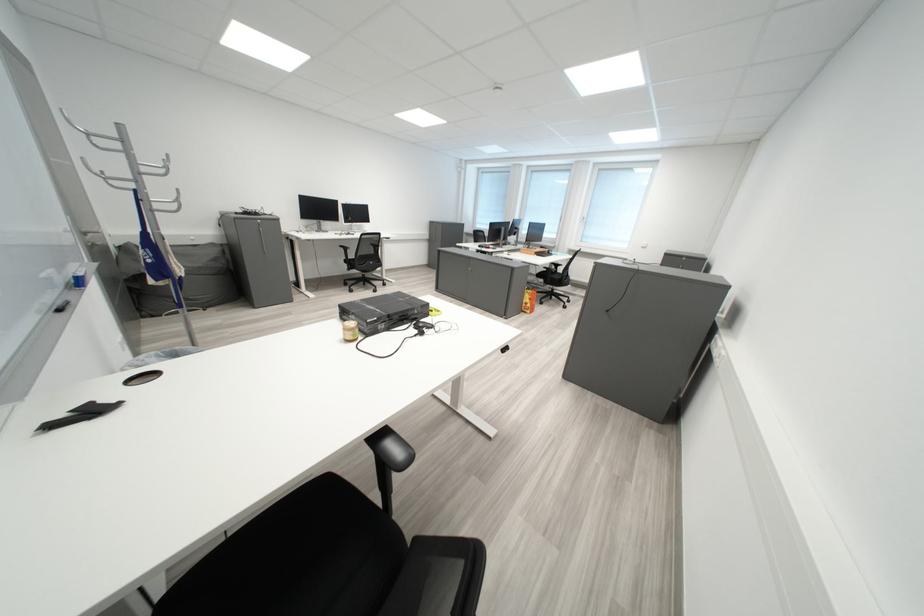
Where is `orange paper bag`? orange paper bag is located at coordinates pyautogui.click(x=529, y=300).